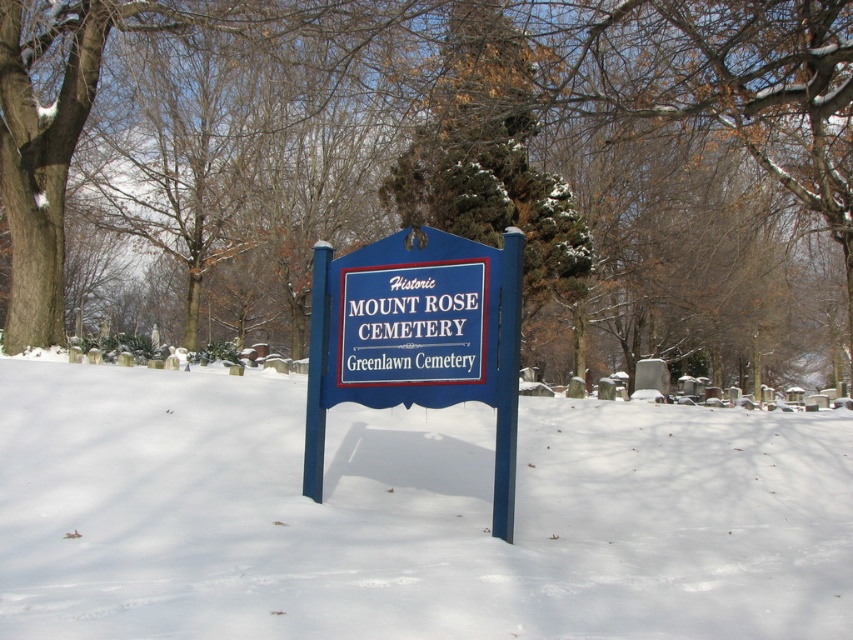
Question: Among these objects, which one is nearest to the camera?

Choices:
 (A) blue painted wood sign at center
 (B) green textured evergreen at center

Answer: (A)

Question: Is green textured evergreen at center wider than white powdery snow at center?

Choices:
 (A) yes
 (B) no

Answer: (A)

Question: Is green textured evergreen at center in front of blue painted wood sign at center?

Choices:
 (A) yes
 (B) no

Answer: (B)

Question: Estimate the real-world distances between objects in this image. Which object is closer to the green textured evergreen at center?

Choices:
 (A) blue painted wood sign at center
 (B) white powdery snow at center

Answer: (B)

Question: Does green textured evergreen at center have a larger size compared to white powdery snow at center?

Choices:
 (A) yes
 (B) no

Answer: (A)

Question: Which point is closer to the camera taking this photo?

Choices:
 (A) (473, 269)
 (B) (126, 419)

Answer: (A)